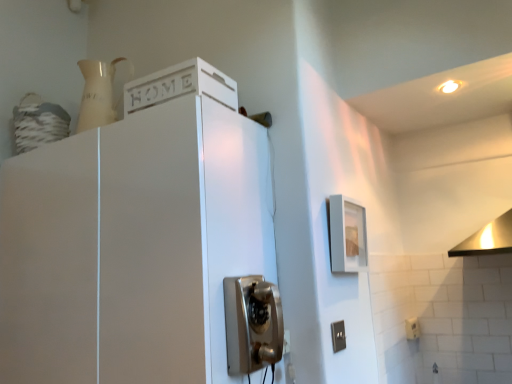
At what (x,y) coordinates should I click in order to perform the action: click on white matte cabinet at upper left. Please return your answer as a coordinate pair (x, y). This screenshot has height=384, width=512. Looking at the image, I should click on (143, 244).

Image resolution: width=512 pixels, height=384 pixels. Describe the element at coordinates (412, 328) in the screenshot. I see `white plastic electric outlet at lower right, marked as the 1th electric outlet in a right-to-left arrangement` at that location.

Image resolution: width=512 pixels, height=384 pixels. Describe the element at coordinates (338, 336) in the screenshot. I see `gray plastic electrical outlet at lower right, the 2th electric outlet positioned from the back` at that location.

This screenshot has width=512, height=384. I want to click on white matte cabinet at upper left, so click(143, 244).

Does white matte cabinet at upper left have a greater height compared to gray plastic electrical outlet at lower right, which is the 2th electric outlet from bottom to top?

Correct, white matte cabinet at upper left is much taller as gray plastic electrical outlet at lower right, which is the 2th electric outlet from bottom to top.

Is white matte cabinet at upper left facing towards gray plastic electrical outlet at lower right, which is the 2th electric outlet from bottom to top?

No, white matte cabinet at upper left is not oriented towards gray plastic electrical outlet at lower right, which is the 2th electric outlet from bottom to top.

In the image, is white matte cabinet at upper left positioned in front of or behind gray plastic electrical outlet at lower right, acting as the first electric outlet starting from the front?

white matte cabinet at upper left is in front of gray plastic electrical outlet at lower right, acting as the first electric outlet starting from the front.

The width and height of the screenshot is (512, 384). Find the location of `the 1st electric outlet directly beneath the white matte cabinet at upper left (from a real-world perspective)`. the 1st electric outlet directly beneath the white matte cabinet at upper left (from a real-world perspective) is located at coordinates (338, 336).

Which object is thinner, metallic vintage phone at center or gray plastic electrical outlet at lower right, acting as the first electric outlet starting from the front?

Thinner between the two is gray plastic electrical outlet at lower right, acting as the first electric outlet starting from the front.

Is point (234, 369) closer or farther from the camera than point (338, 322)?

Point (234, 369).

From the picture: How much distance is there between metallic vintage phone at center and gray plastic electrical outlet at lower right, the 1th electric outlet viewed from the top?

The distance of metallic vintage phone at center from gray plastic electrical outlet at lower right, the 1th electric outlet viewed from the top, is 15.60 inches.

Is white plastic electric outlet at lower right, marked as the 1th electric outlet in a right-to-left arrangement, at the back of gray plastic electrical outlet at lower right, the 2th electric outlet positioned from the back?

No.

From a real-world perspective, relative to white plastic electric outlet at lower right, which ranks as the first electric outlet in back-to-front order, is gray plastic electrical outlet at lower right, the 2th electric outlet positioned from the back, vertically above or below?

gray plastic electrical outlet at lower right, the 2th electric outlet positioned from the back, is above white plastic electric outlet at lower right, which ranks as the first electric outlet in back-to-front order.

From the picture: Between gray plastic electrical outlet at lower right, which ranks as the first electric outlet in left-to-right order, and white plastic electric outlet at lower right, the second electric outlet when ordered from top to bottom, which one has smaller size?

Smaller between the two is gray plastic electrical outlet at lower right, which ranks as the first electric outlet in left-to-right order.

Is gray plastic electrical outlet at lower right, which is the 2th electric outlet from bottom to top, to the left or to the right of white plastic electric outlet at lower right, marked as the 1th electric outlet in a right-to-left arrangement, in the image?

gray plastic electrical outlet at lower right, which is the 2th electric outlet from bottom to top, is to the left of white plastic electric outlet at lower right, marked as the 1th electric outlet in a right-to-left arrangement.

Looking at this image, can you tell me how much metallic vintage phone at center and white matte cabinet at upper left differ in facing direction?

metallic vintage phone at center and white matte cabinet at upper left are facing 89.9 degrees away from each other.

Identify the location of cabinetry on the left side of metallic vintage phone at center. The width and height of the screenshot is (512, 384). (143, 244).

Considering the sizes of metallic vintage phone at center and white matte cabinet at upper left in the image, is metallic vintage phone at center wider or thinner than white matte cabinet at upper left?

Clearly, metallic vintage phone at center has less width compared to white matte cabinet at upper left.

From the image's perspective, is white matte cabinet at upper left above white plastic electric outlet at lower right, the second electric outlet when ordered from top to bottom?

Yes, from the image's perspective, white matte cabinet at upper left is on top of white plastic electric outlet at lower right, the second electric outlet when ordered from top to bottom.

Does white matte cabinet at upper left have a greater height compared to white plastic electric outlet at lower right, marked as the 1th electric outlet in a right-to-left arrangement?

Yes.

Is white matte cabinet at upper left not close to white plastic electric outlet at lower right, which is counted as the 2th electric outlet, starting from the front?

Yes, white matte cabinet at upper left is far from white plastic electric outlet at lower right, which is counted as the 2th electric outlet, starting from the front.

Does point (215, 331) appear closer or farther from the camera than point (410, 337)?

Point (215, 331) appears to be closer to the viewer than point (410, 337).

Is white plastic electric outlet at lower right, marked as the first electric outlet in a bottom-to-top arrangement, next to metallic vintage phone at center and touching it?

No.

Considering the relative sizes of white plastic electric outlet at lower right, which is counted as the 2th electric outlet, starting from the front, and metallic vintage phone at center in the image provided, is white plastic electric outlet at lower right, which is counted as the 2th electric outlet, starting from the front, thinner than metallic vintage phone at center?

Yes, white plastic electric outlet at lower right, which is counted as the 2th electric outlet, starting from the front, is thinner than metallic vintage phone at center.

Who is smaller, white plastic electric outlet at lower right, which is counted as the 2th electric outlet, starting from the front, or metallic vintage phone at center?

Smaller between the two is white plastic electric outlet at lower right, which is counted as the 2th electric outlet, starting from the front.

What's the angular difference between white plastic electric outlet at lower right, marked as the 1th electric outlet in a right-to-left arrangement, and metallic vintage phone at center's facing directions?

The angular difference between white plastic electric outlet at lower right, marked as the 1th electric outlet in a right-to-left arrangement, and metallic vintage phone at center is 1.57 degrees.

Is the surface of gray plastic electrical outlet at lower right, which ranks as the first electric outlet in left-to-right order, in direct contact with metallic vintage phone at center?

gray plastic electrical outlet at lower right, which ranks as the first electric outlet in left-to-right order, and metallic vintage phone at center are clearly separated.

Starting from the metallic vintage phone at center, which electric outlet is the 1st one behind? Please provide its 2D coordinates.

[(338, 336)]

Is point (336, 338) positioned before point (273, 345)?

No, (336, 338) is behind (273, 345).

Image resolution: width=512 pixels, height=384 pixels. I want to click on the 1st electric outlet located beneath the white matte cabinet at upper left (from a real-world perspective), so click(x=338, y=336).

The image size is (512, 384). What are the coordinates of `door handle above the gray plastic electrical outlet at lower right, which is the 2th electric outlet from bottom to top (from a real-world perspective)` in the screenshot? It's located at (252, 323).

Considering their positions, is white plastic electric outlet at lower right, the second electric outlet when ordered from top to bottom, positioned closer to gray plastic electrical outlet at lower right, positioned as the second electric outlet in right-to-left order, than metallic vintage phone at center?

metallic vintage phone at center is closer to gray plastic electrical outlet at lower right, positioned as the second electric outlet in right-to-left order.

Which object lies further to the anchor point metallic vintage phone at center, white plastic electric outlet at lower right, marked as the first electric outlet in a bottom-to-top arrangement, or white matte cabinet at upper left?

white plastic electric outlet at lower right, marked as the first electric outlet in a bottom-to-top arrangement.

Looking at the image, which one is located closer to white plastic electric outlet at lower right, marked as the 1th electric outlet in a right-to-left arrangement, metallic vintage phone at center or gray plastic electrical outlet at lower right, the 2th electric outlet positioned from the back?

gray plastic electrical outlet at lower right, the 2th electric outlet positioned from the back, is closer to white plastic electric outlet at lower right, marked as the 1th electric outlet in a right-to-left arrangement.

Considering their positions, is metallic vintage phone at center positioned closer to gray plastic electrical outlet at lower right, which ranks as the first electric outlet in left-to-right order, than white matte cabinet at upper left?

metallic vintage phone at center lies closer to gray plastic electrical outlet at lower right, which ranks as the first electric outlet in left-to-right order, than the other object.

Based on their spatial positions, is white plastic electric outlet at lower right, marked as the first electric outlet in a bottom-to-top arrangement, or gray plastic electrical outlet at lower right, the 1th electric outlet viewed from the top, further from white matte cabinet at upper left?

The object further to white matte cabinet at upper left is white plastic electric outlet at lower right, marked as the first electric outlet in a bottom-to-top arrangement.

Which object lies nearer to the anchor point metallic vintage phone at center, gray plastic electrical outlet at lower right, the 1th electric outlet viewed from the top, or white plastic electric outlet at lower right, marked as the 1th electric outlet in a right-to-left arrangement?

gray plastic electrical outlet at lower right, the 1th electric outlet viewed from the top, lies closer to metallic vintage phone at center than the other object.

Based on their spatial positions, is white matte cabinet at upper left or white plastic electric outlet at lower right, marked as the first electric outlet in a bottom-to-top arrangement, closer to metallic vintage phone at center?

white matte cabinet at upper left.

From the image, which object appears to be nearer to metallic vintage phone at center, white plastic electric outlet at lower right, which ranks as the first electric outlet in back-to-front order, or gray plastic electrical outlet at lower right, the 2th electric outlet positioned from the back?

gray plastic electrical outlet at lower right, the 2th electric outlet positioned from the back, lies closer to metallic vintage phone at center than the other object.

The image size is (512, 384). I want to click on electric outlet between white matte cabinet at upper left and white plastic electric outlet at lower right, which is counted as the 2th electric outlet, starting from the front, in the horizontal direction, so click(x=338, y=336).

Locate an element on the screen. The height and width of the screenshot is (384, 512). door handle situated between white matte cabinet at upper left and gray plastic electrical outlet at lower right, which ranks as the first electric outlet in left-to-right order, from left to right is located at coordinates (252, 323).

The width and height of the screenshot is (512, 384). Identify the location of door handle between white matte cabinet at upper left and white plastic electric outlet at lower right, marked as the first electric outlet in a bottom-to-top arrangement. click(252, 323).

Where is `electric outlet between metallic vintage phone at center and white plastic electric outlet at lower right, marked as the first electric outlet in a bottom-to-top arrangement, from front to back`? The width and height of the screenshot is (512, 384). electric outlet between metallic vintage phone at center and white plastic electric outlet at lower right, marked as the first electric outlet in a bottom-to-top arrangement, from front to back is located at coordinates (338, 336).